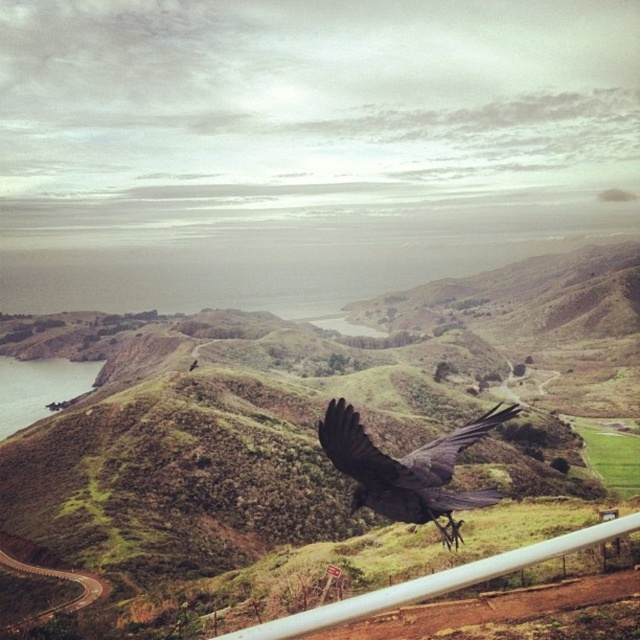
Between point (12, 467) and point (316, 614), which one is positioned behind?

The point (12, 467) is more distant.

Is green grassy hillside at center to the right of white plastic fence at lower right from the viewer's perspective?

No, green grassy hillside at center is not to the right of white plastic fence at lower right.

Is point (378, 364) farther from camera compared to point (552, 556)?

That is True.

Find the location of a particular element. This screenshot has height=640, width=640. green grassy hillside at center is located at coordinates (312, 428).

Which of these two, shiny black crow at center or white plastic fence at lower right, stands taller?

shiny black crow at center is taller.

Does shiny black crow at center appear over white plastic fence at lower right?

Yes, shiny black crow at center is above white plastic fence at lower right.

The width and height of the screenshot is (640, 640). What are the coordinates of `shiny black crow at center` in the screenshot? It's located at (406, 468).

Can you confirm if green grassy hillside at center is bigger than shiny black crow at center?

Yes.

Does green grassy hillside at center have a greater height compared to shiny black crow at center?

Correct, green grassy hillside at center is much taller as shiny black crow at center.

Is point (296, 532) more distant than point (452, 522)?

Yes.

Find the location of a particular element. The height and width of the screenshot is (640, 640). green grassy hillside at center is located at coordinates (312, 428).